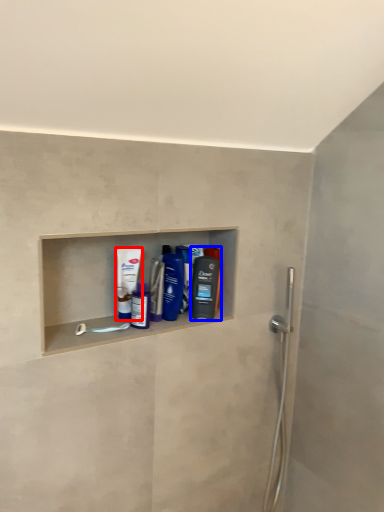
Question: Which object appears farthest to the camera in this image, mouthwash (highlighted by a red box) or mouthwash (highlighted by a blue box)?

Choices:
 (A) mouthwash
 (B) mouthwash

Answer: (B)